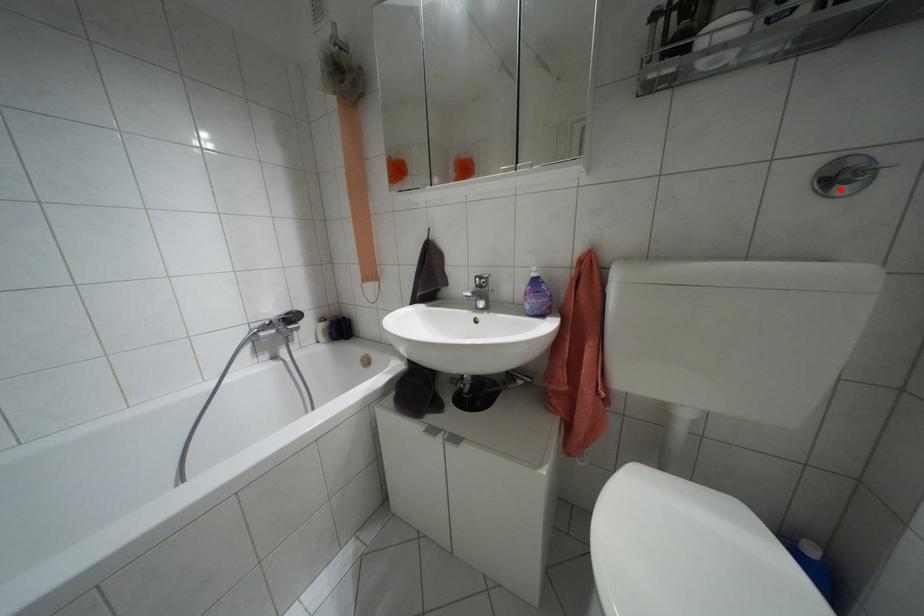
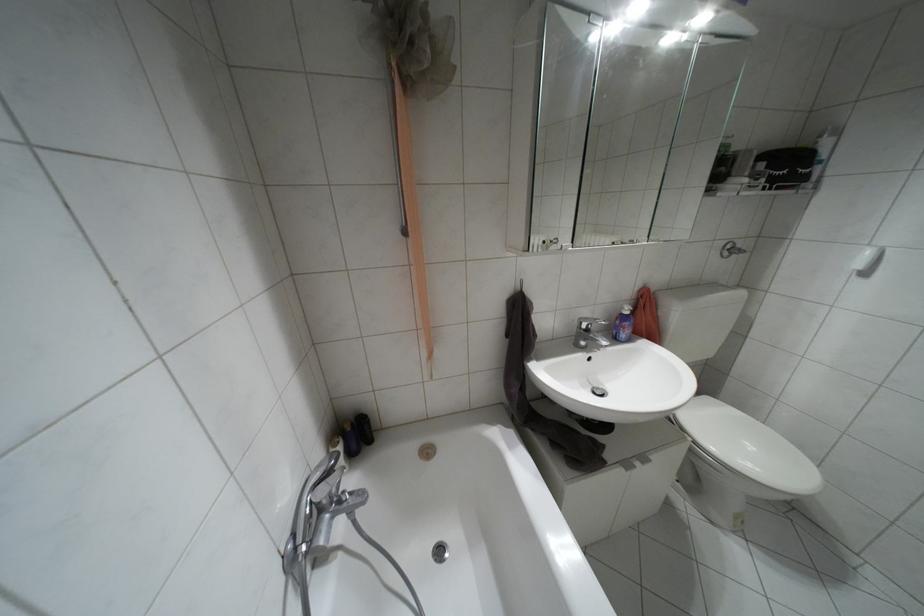
Locate, in the second image, the point that corresponds to the highlighted location in the first image.

(723, 254)